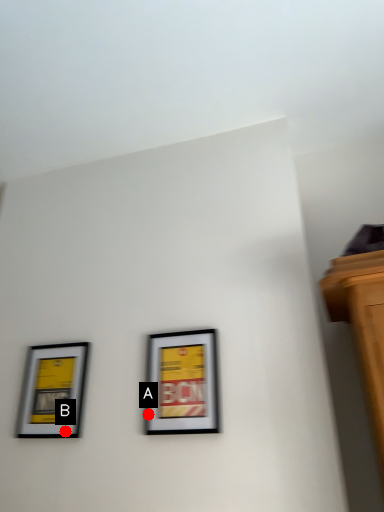
Question: Two points are circled on the image, labeled by A and B beside each circle. Which point is farther from the camera taking this photo?

Choices:
 (A) A is further
 (B) B is further

Answer: (B)